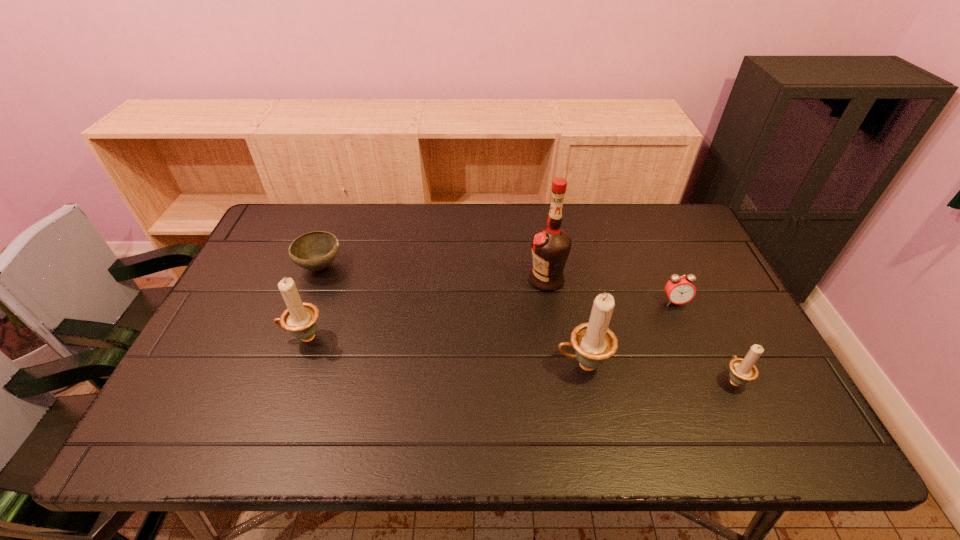
Where is `vacant space at the far left corner`? The width and height of the screenshot is (960, 540). vacant space at the far left corner is located at coordinates (277, 209).

Find the location of a particular element. vacant space at the far right corner of the desktop is located at coordinates (675, 239).

Locate an element on the screen. vacant space that's between the fourth shortest object and the second candle_holder from left to right is located at coordinates (444, 351).

I want to click on free space between the second candle_holder from left to right and the liquor, so click(x=564, y=322).

The width and height of the screenshot is (960, 540). I want to click on empty space between the second candle_holder from right to left and the bowl, so click(451, 316).

This screenshot has height=540, width=960. In order to click on empty location between the bowl and the third shortest object in this screenshot , I will do `click(527, 323)`.

Find the location of a particular element. free space that is in between the fourth shortest object and the bowl is located at coordinates (312, 302).

Image resolution: width=960 pixels, height=540 pixels. Find the location of `empty location between the rightmost candle_holder and the second tallest candle_holder`. empty location between the rightmost candle_holder and the second tallest candle_holder is located at coordinates (518, 359).

This screenshot has width=960, height=540. In order to click on free spot between the shortest candle_holder and the bowl in this screenshot , I will do `click(527, 323)`.

Locate an element on the screen. Image resolution: width=960 pixels, height=540 pixels. free space that is in between the bowl and the second candle_holder from left to right is located at coordinates tap(451, 316).